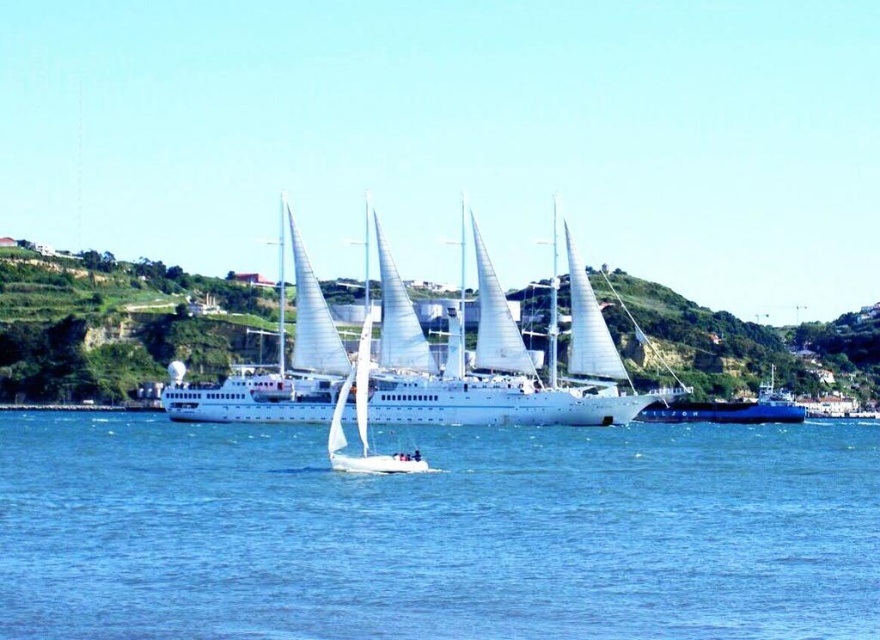
Can you confirm if blue water at center is smaller than blue matte ship at center?

No, blue water at center is not smaller than blue matte ship at center.

Based on the photo, is blue water at center to the left of blue matte ship at center from the viewer's perspective?

Yes, blue water at center is to the left of blue matte ship at center.

Locate an element on the screen. blue water at center is located at coordinates (437, 532).

Can you confirm if white glossy ship at center is shorter than white matte sailboat at center?

Indeed, white glossy ship at center has a lesser height compared to white matte sailboat at center.

How much distance is there between white glossy ship at center and white matte sailboat at center?

Answer: The distance of white glossy ship at center from white matte sailboat at center is 12.57 meters.

Who is more forward, (232, 401) or (334, 451)?

Positioned in front is point (334, 451).

Identify the location of white glossy ship at center. (497, 360).

Between white glossy ship at center and blue matte ship at center, which one is positioned lower?

blue matte ship at center is below.

Can you confirm if white glossy ship at center is thinner than blue matte ship at center?

Incorrect, white glossy ship at center's width is not less than blue matte ship at center's.

Image resolution: width=880 pixels, height=640 pixels. Find the location of `white glossy ship at center`. white glossy ship at center is located at coordinates pyautogui.click(x=497, y=360).